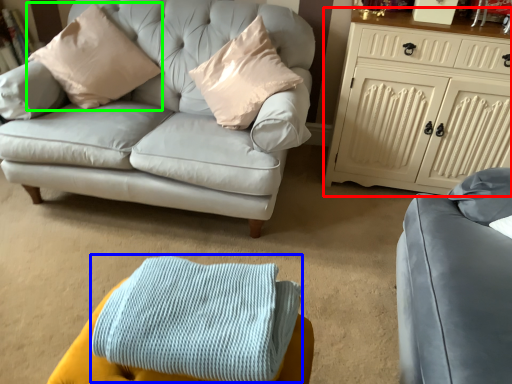
Question: Considering the real-world distances, which object is closest to cabinetry (highlighted by a red box)? blanket (highlighted by a blue box) or pillow (highlighted by a green box).

Choices:
 (A) blanket
 (B) pillow

Answer: (B)